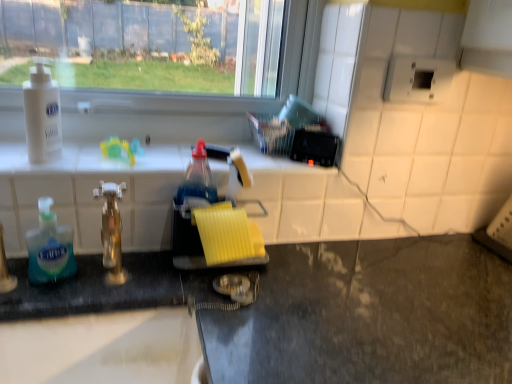
This screenshot has height=384, width=512. I want to click on blank space to the left of gold metallic faucet at center, so click(x=58, y=286).